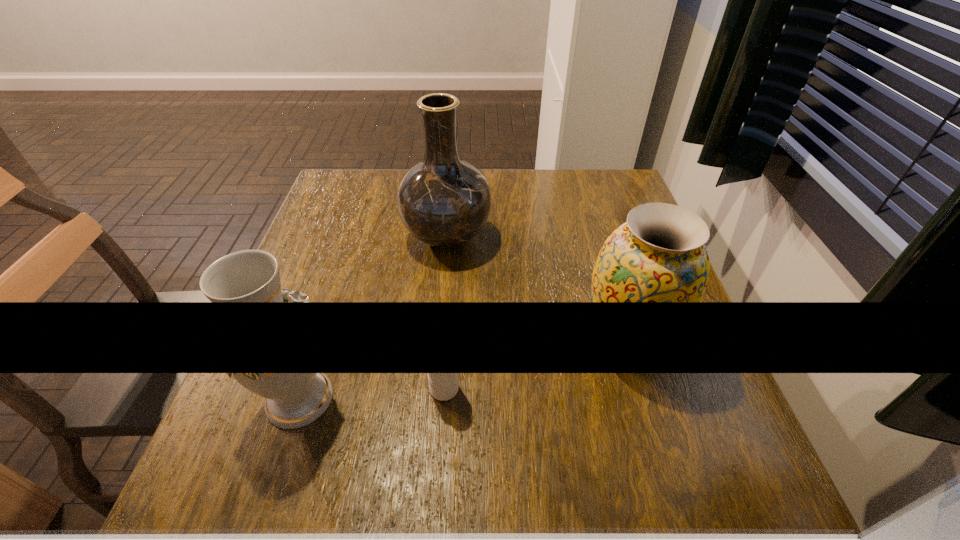
The height and width of the screenshot is (540, 960). In order to click on vacant point located between the leftmost object and the rightmost object in this screenshot , I will do `click(463, 367)`.

Select which object is the second closest to the second vase from right to left. Please provide its 2D coordinates. Your answer should be formatted as a tuple, i.e. [(x, y)], where the tuple contains the x and y coordinates of a point satisfying the conditions above.

[(249, 275)]

Where is `the closest object to the farthest object`? The width and height of the screenshot is (960, 540). the closest object to the farthest object is located at coordinates (659, 255).

This screenshot has width=960, height=540. I want to click on vase that can be found as the closest to the farthest vase, so click(x=659, y=255).

The image size is (960, 540). I want to click on vase that is the closest to the rightmost object, so click(x=444, y=201).